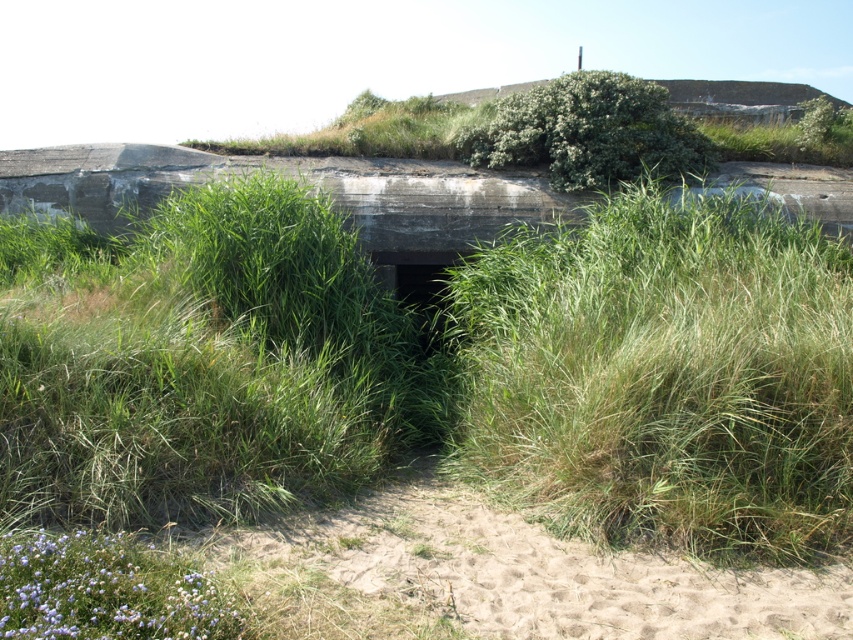
You are a botanist examining the purple soft flower at lower left and the green leafy bush at upper center in the scene. Which of these two plants is shorter?

The purple soft flower at lower left is shorter than the green leafy bush at upper center.